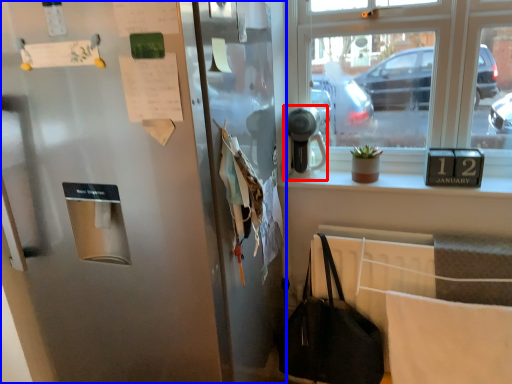
Question: Which of the following is the closest to the observer, appliance (highlighted by a red box) or door (highlighted by a blue box)?

Choices:
 (A) appliance
 (B) door

Answer: (B)